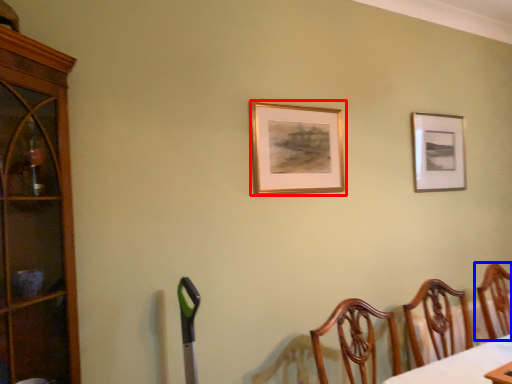
Question: Among these objects, which one is farthest to the camera, picture frame (highlighted by a red box) or chair (highlighted by a blue box)?

Choices:
 (A) picture frame
 (B) chair

Answer: (B)